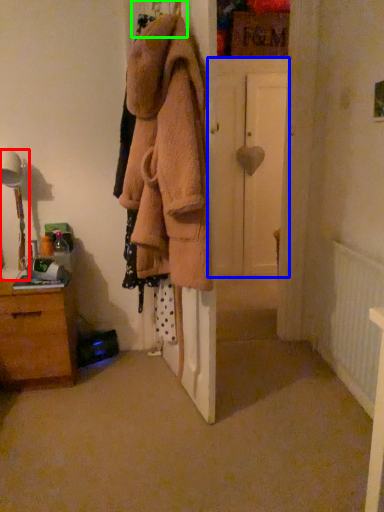
Question: Considering the real-world distances, which object is closest to table lamp (highlighted by a red box)? door (highlighted by a blue box) or hanger (highlighted by a green box).

Choices:
 (A) door
 (B) hanger

Answer: (B)